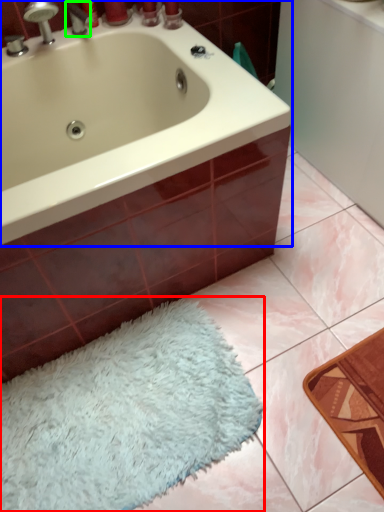
Question: Which object is the closest to the bath mat (highlighted by a red box)? Choose among these: bathtub (highlighted by a blue box) or tap (highlighted by a green box).

Choices:
 (A) bathtub
 (B) tap

Answer: (A)